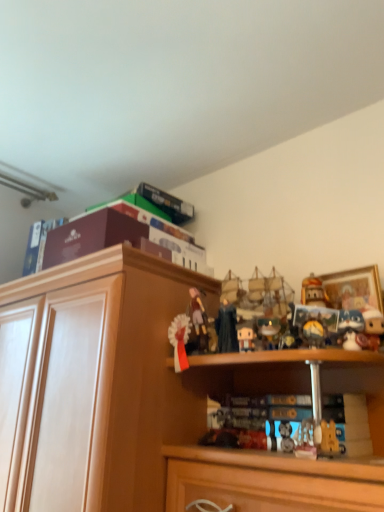
Question: From the image's perspective, does white glossy ribbon at center, which ranks as the fifth toy in right-to-left order, appear higher than wooden cabinet at upper center?

Choices:
 (A) no
 (B) yes

Answer: (B)

Question: Is there a large distance between white glossy ribbon at center, which ranks as the first toy in left-to-right order, and wooden cabinet at upper center?

Choices:
 (A) no
 (B) yes

Answer: (A)

Question: Is white glossy ribbon at center, which ranks as the first toy in left-to-right order, bigger than wooden cabinet at upper center?

Choices:
 (A) no
 (B) yes

Answer: (A)

Question: Is white glossy ribbon at center, which ranks as the fifth toy in right-to-left order, turned away from wooden cabinet at upper center?

Choices:
 (A) no
 (B) yes

Answer: (B)

Question: Is white glossy ribbon at center, which ranks as the fifth toy in right-to-left order, further to camera compared to wooden cabinet at upper center?

Choices:
 (A) no
 (B) yes

Answer: (B)

Question: Can you confirm if white glossy ribbon at center, which ranks as the fifth toy in right-to-left order, is smaller than wooden cabinet at upper center?

Choices:
 (A) yes
 (B) no

Answer: (A)

Question: Can you confirm if white plush toy at right, the first toy positioned from the right, is taller than wooden cabinet at upper center?

Choices:
 (A) yes
 (B) no

Answer: (B)

Question: From a real-world perspective, is white plush toy at right, acting as the fifth toy starting from the left, positioned over wooden cabinet at upper center based on gravity?

Choices:
 (A) yes
 (B) no

Answer: (A)

Question: Does white plush toy at right, acting as the fifth toy starting from the left, appear on the right side of wooden cabinet at upper center?

Choices:
 (A) no
 (B) yes

Answer: (B)

Question: From the image's perspective, is white plush toy at right, the first toy positioned from the right, above wooden cabinet at upper center?

Choices:
 (A) no
 (B) yes

Answer: (B)

Question: Considering the relative sizes of white plush toy at right, acting as the fifth toy starting from the left, and wooden cabinet at upper center in the image provided, is white plush toy at right, acting as the fifth toy starting from the left, smaller than wooden cabinet at upper center?

Choices:
 (A) no
 (B) yes

Answer: (B)

Question: Can you confirm if white plush toy at right, the first toy positioned from the right, is shorter than wooden cabinet at upper center?

Choices:
 (A) yes
 (B) no

Answer: (A)

Question: Is white matte figurine at center, which is counted as the 2th toy, starting from the right, positioned beyond the bounds of wooden cabinet at upper center?

Choices:
 (A) yes
 (B) no

Answer: (A)